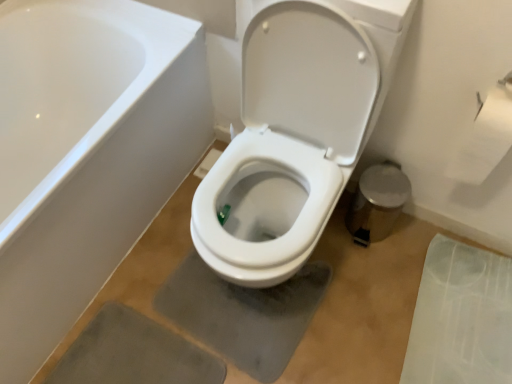
What do you see at coordinates (485, 136) in the screenshot?
I see `white paper at upper right` at bounding box center [485, 136].

Image resolution: width=512 pixels, height=384 pixels. In order to click on white paper at upper right in this screenshot , I will do `click(485, 136)`.

I want to click on white glossy toilet at center, so click(295, 133).

Would you say white glossy toilet at center is outside white paper at upper right?

Absolutely, white glossy toilet at center is external to white paper at upper right.

Is point (339, 68) farther from viewer compared to point (486, 104)?

That is False.

Considering the relative sizes of white glossy toilet at center and white paper at upper right in the image provided, is white glossy toilet at center smaller than white paper at upper right?

No, white glossy toilet at center is not smaller than white paper at upper right.

From the image's perspective, is white glossy toilet at center beneath white paper at upper right?

Indeed, from the image's perspective, white glossy toilet at center is shown beneath white paper at upper right.

Could you tell me if transparent plastic mat at lower right is facing white glossy toilet at center?

Yes, transparent plastic mat at lower right is facing white glossy toilet at center.

Is point (499, 304) closer or farther from the camera than point (253, 102)?

Clearly, point (499, 304) is more distant from the camera than point (253, 102).

Can you confirm if transparent plastic mat at lower right is bigger than white glossy toilet at center?

Actually, transparent plastic mat at lower right might be smaller than white glossy toilet at center.

In terms of width, does transparent plastic mat at lower right look wider or thinner when compared to white glossy toilet at center?

Considering their sizes, transparent plastic mat at lower right looks slimmer than white glossy toilet at center.

Is transparent plastic mat at lower right facing away from white paper at upper right?

That's not correct — transparent plastic mat at lower right is not looking away from white paper at upper right.

Which of these two, transparent plastic mat at lower right or white paper at upper right, is bigger?

transparent plastic mat at lower right.

From the image's perspective, is transparent plastic mat at lower right positioned above or below white paper at upper right?

transparent plastic mat at lower right is below white paper at upper right.

Where is `toilet paper above the transparent plastic mat at lower right (from the image's perspective)`? The width and height of the screenshot is (512, 384). toilet paper above the transparent plastic mat at lower right (from the image's perspective) is located at coordinates (485, 136).

Considering the positions of objects white glossy toilet at center and transparent plastic mat at lower right in the image provided, who is behind, white glossy toilet at center or transparent plastic mat at lower right?

transparent plastic mat at lower right is further away from the camera.

Locate an element on the screen. Image resolution: width=512 pixels, height=384 pixels. toilet above the transparent plastic mat at lower right (from a real-world perspective) is located at coordinates pos(295,133).

Considering the relative sizes of white glossy toilet at center and transparent plastic mat at lower right in the image provided, is white glossy toilet at center shorter than transparent plastic mat at lower right?

No, white glossy toilet at center is not shorter than transparent plastic mat at lower right.

Is white glossy toilet at center positioned far away from transparent plastic mat at lower right?

No.

Where is `toilet paper above the transparent plastic mat at lower right (from a real-world perspective)`? The image size is (512, 384). toilet paper above the transparent plastic mat at lower right (from a real-world perspective) is located at coordinates pyautogui.click(x=485, y=136).

Is white paper at upper right facing towards transparent plastic mat at lower right?

No, white paper at upper right is not turned towards transparent plastic mat at lower right.

Can you confirm if white paper at upper right is smaller than transparent plastic mat at lower right?

Yes.

At what (x,y) coordinates should I click in order to perform the action: click on toilet below the white paper at upper right (from the image's perspective). Please return your answer as a coordinate pair (x, y). The height and width of the screenshot is (384, 512). Looking at the image, I should click on (295, 133).

Is white paper at upper right next to white glossy toilet at center and touching it?

No, white paper at upper right is not in contact with white glossy toilet at center.

From the image's perspective, is white paper at upper right located above white glossy toilet at center?

Yes, from the image's perspective, white paper at upper right is over white glossy toilet at center.

Can you confirm if white paper at upper right is bigger than white glossy toilet at center?

No.

At what (x,y) coordinates should I click in order to perform the action: click on toilet below the white paper at upper right (from the image's perspective). Please return your answer as a coordinate pair (x, y). Looking at the image, I should click on (295, 133).

Locate an element on the screen. The height and width of the screenshot is (384, 512). concrete located on the right of white glossy toilet at center is located at coordinates (461, 317).

Considering their positions, is white glossy toilet at center positioned closer to transparent plastic mat at lower right than white paper at upper right?

Based on the image, white paper at upper right appears to be nearer to transparent plastic mat at lower right.

In the scene shown: Based on their spatial positions, is white paper at upper right or white glossy toilet at center further from transparent plastic mat at lower right?

white glossy toilet at center lies further to transparent plastic mat at lower right than the other object.

Based on their spatial positions, is white glossy toilet at center or transparent plastic mat at lower right further from white paper at upper right?

transparent plastic mat at lower right.

Based on their spatial positions, is transparent plastic mat at lower right or white paper at upper right further from white glossy toilet at center?

The object further to white glossy toilet at center is transparent plastic mat at lower right.

Based on their spatial positions, is transparent plastic mat at lower right or white glossy toilet at center closer to white paper at upper right?

white glossy toilet at center lies closer to white paper at upper right than the other object.

When comparing their distances from white glossy toilet at center, does white paper at upper right or transparent plastic mat at lower right seem further?

transparent plastic mat at lower right is positioned further to the anchor white glossy toilet at center.

At what (x,y) coordinates should I click in order to perform the action: click on toilet paper between white glossy toilet at center and transparent plastic mat at lower right from left to right. Please return your answer as a coordinate pair (x, y). Image resolution: width=512 pixels, height=384 pixels. Looking at the image, I should click on click(x=485, y=136).